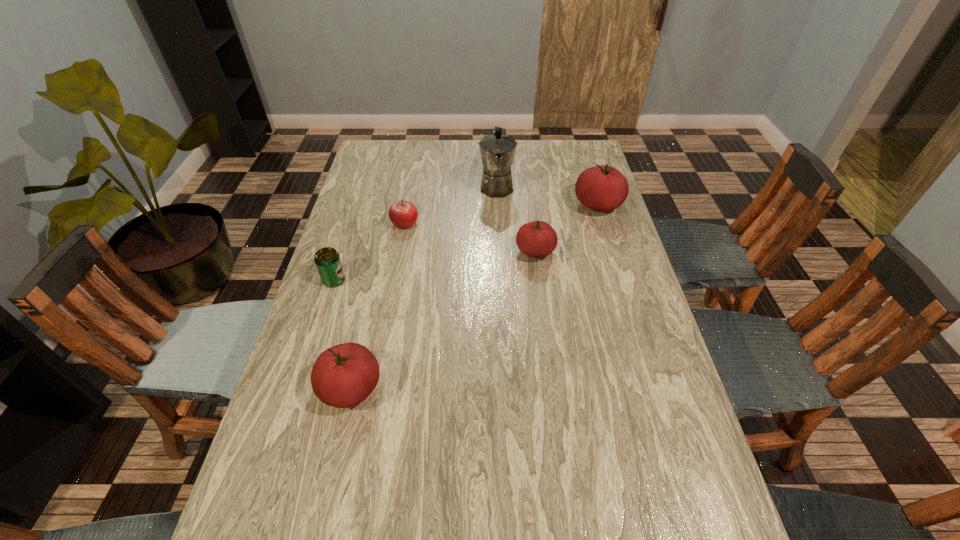
Identify the location of free space for an extra tomato to achieve even spacing. The width and height of the screenshot is (960, 540). (456, 310).